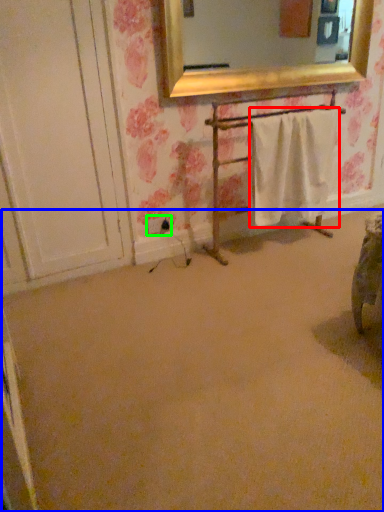
Question: Based on their relative distances, which object is nearer to bath towel (highlighted by a red box)? Choose from plain (highlighted by a blue box) and electric outlet (highlighted by a green box).

Choices:
 (A) plain
 (B) electric outlet

Answer: (B)